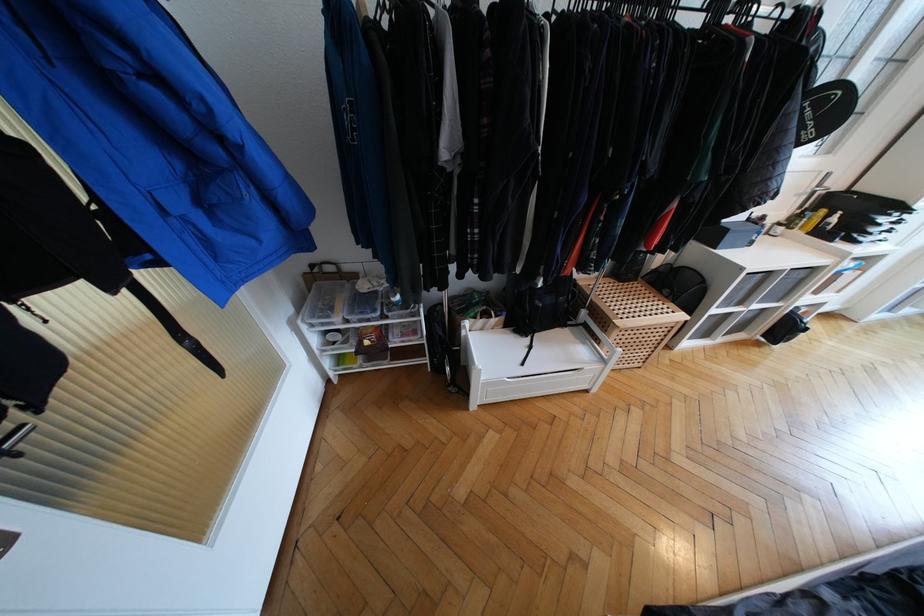
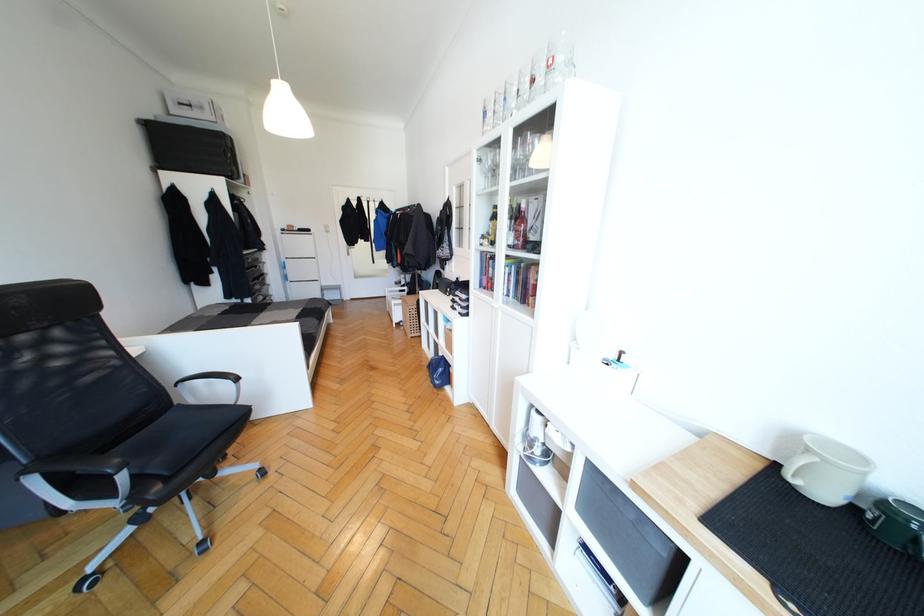
Question: I am providing you with two images of the same scene from different viewpoints. Please identify which objects are invisible in image2.

Choices:
 (A) pink liquor bottle
 (B) drinking glass
 (C) black clothes hanger
 (D) black spray bottle trigger

Answer: (D)